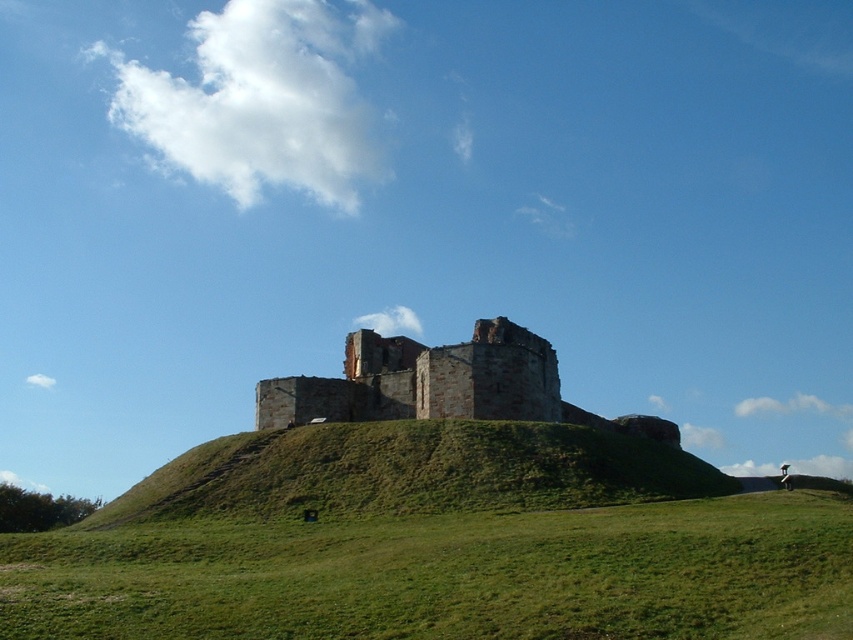
Is green grassy hillside at center smaller than brown stone castle at center?

Incorrect, green grassy hillside at center is not smaller in size than brown stone castle at center.

Between green grassy hillside at center and brown stone castle at center, which one is positioned lower?

green grassy hillside at center is below.

Who is more distant from viewer, (531,428) or (471,410)?

The point (471,410) is more distant.

Identify the location of green grassy hillside at center. (412, 472).

Is green grassy hill at lower center above brown stone castle at center?

Actually, green grassy hill at lower center is below brown stone castle at center.

Which of these two, green grassy hill at lower center or brown stone castle at center, stands shorter?

Standing shorter between the two is green grassy hill at lower center.

Image resolution: width=853 pixels, height=640 pixels. What do you see at coordinates (448, 576) in the screenshot?
I see `green grassy hill at lower center` at bounding box center [448, 576].

The height and width of the screenshot is (640, 853). I want to click on green grassy hill at lower center, so click(x=448, y=576).

Can you confirm if green grassy hill at lower center is smaller than green grassy hillside at center?

Indeed, green grassy hill at lower center has a smaller size compared to green grassy hillside at center.

Who is more forward, (260, 556) or (482, 461)?

Point (260, 556)

Where is `green grassy hill at lower center`? green grassy hill at lower center is located at coordinates (448, 576).